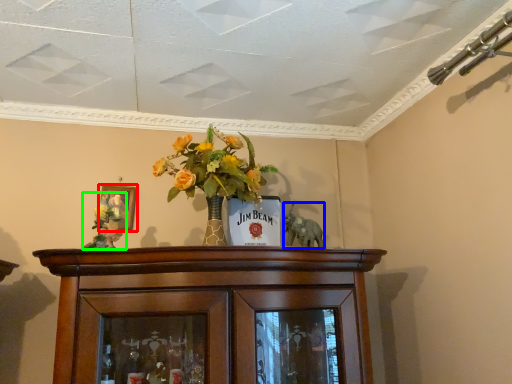
Question: Based on their relative distances, which object is farther from picture frame (highlighted by a red box)? Choose from animal (highlighted by a blue box) and floral arrangement (highlighted by a green box).

Choices:
 (A) animal
 (B) floral arrangement

Answer: (A)